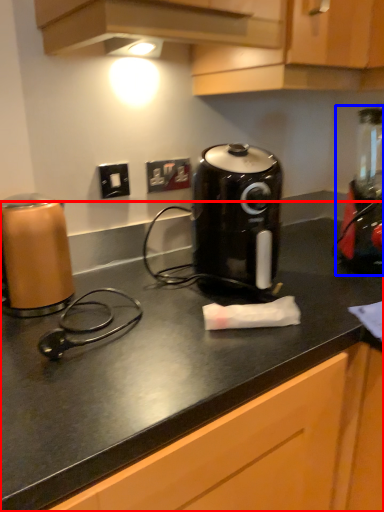
Question: Among these objects, which one is nearest to the camera, counter (highlighted by a red box) or blender (highlighted by a blue box)?

Choices:
 (A) counter
 (B) blender

Answer: (A)